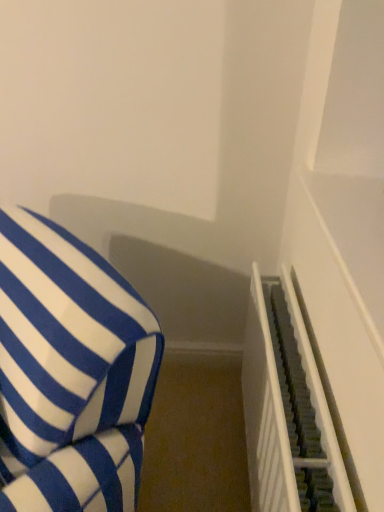
Question: Considering the positions of dark gray textured stairwell at right and blue and white striped cushion at left in the image, is dark gray textured stairwell at right bigger or smaller than blue and white striped cushion at left?

Choices:
 (A) small
 (B) big

Answer: (A)

Question: From a real-world perspective, is dark gray textured stairwell at right positioned above or below blue and white striped cushion at left?

Choices:
 (A) below
 (B) above

Answer: (A)

Question: Considering the positions of point click(x=274, y=463) and point click(x=49, y=493), is point click(x=274, y=463) closer or farther from the camera than point click(x=49, y=493)?

Choices:
 (A) farther
 (B) closer

Answer: (A)

Question: Is blue and white striped cushion at left situated inside dark gray textured stairwell at right or outside?

Choices:
 (A) outside
 (B) inside

Answer: (A)

Question: Is point (67, 422) positioned closer to the camera than point (322, 449)?

Choices:
 (A) farther
 (B) closer

Answer: (A)

Question: From a real-world perspective, is blue and white striped cushion at left physically located above or below dark gray textured stairwell at right?

Choices:
 (A) above
 (B) below

Answer: (A)

Question: In terms of width, does blue and white striped cushion at left look wider or thinner when compared to dark gray textured stairwell at right?

Choices:
 (A) thin
 (B) wide

Answer: (B)